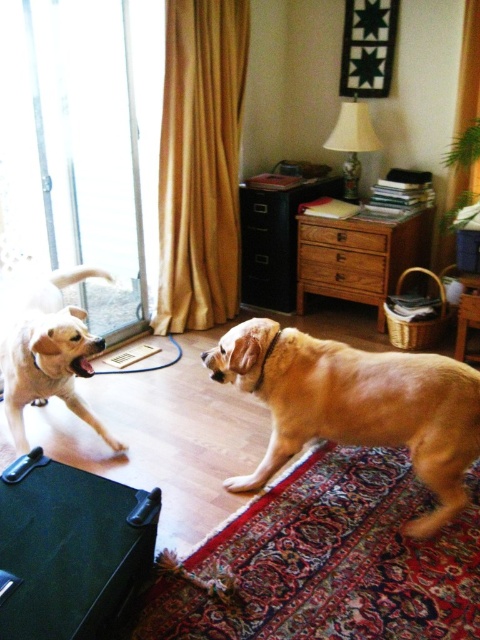
Can you confirm if golden fur dog at center is positioned to the right of wooden cabinet at center?

No, golden fur dog at center is not to the right of wooden cabinet at center.

Is golden fur dog at center above wooden cabinet at center?

Incorrect, golden fur dog at center is not positioned above wooden cabinet at center.

Does point (252, 355) come closer to viewer compared to point (416, 244)?

That is True.

The width and height of the screenshot is (480, 640). I want to click on golden fur dog at center, so click(356, 404).

Is wooden cabinet at center smaller than golden fur dog at left?

Actually, wooden cabinet at center might be larger than golden fur dog at left.

Does point (384, 292) lie behind point (46, 374)?

Yes, point (384, 292) is behind point (46, 374).

Locate an element on the screen. wooden cabinet at center is located at coordinates (359, 257).

At what (x,y) coordinates should I click in order to perform the action: click on wooden cabinet at center. Please return your answer as a coordinate pair (x, y). The width and height of the screenshot is (480, 640). Looking at the image, I should click on (359, 257).

Is transparent glass door at left wider than wooden cabinet at center?

In fact, transparent glass door at left might be narrower than wooden cabinet at center.

Is point (94, 106) positioned behind point (365, 298)?

No, it is in front of (365, 298).

The height and width of the screenshot is (640, 480). In order to click on transparent glass door at left in this screenshot , I will do `click(82, 156)`.